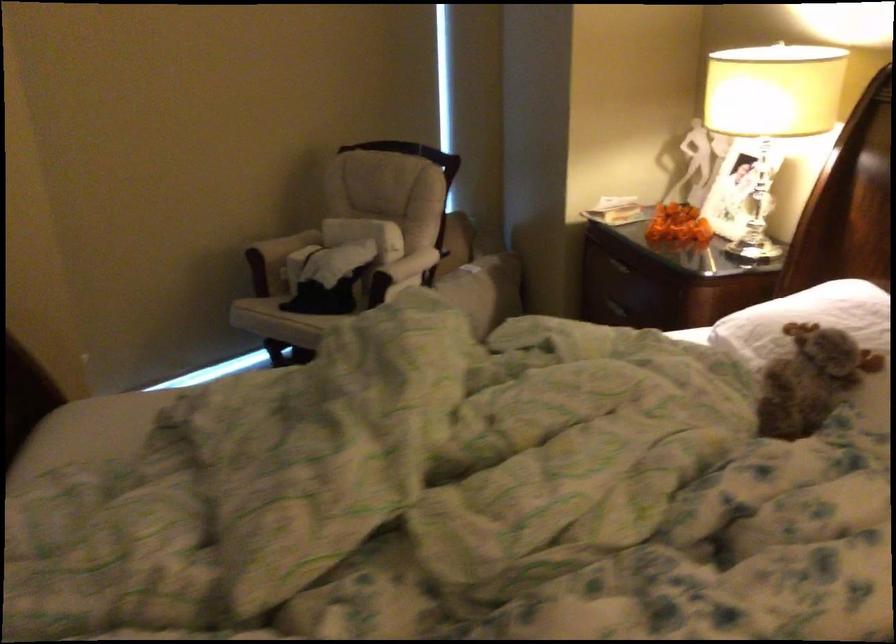
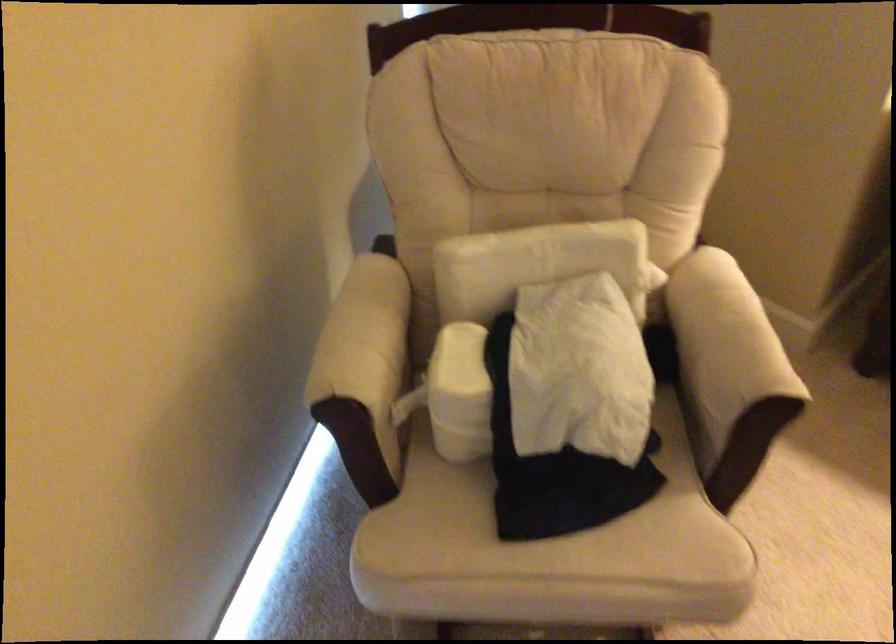
Locate, in the second image, the point that corresponds to pixel 391 261 in the first image.

(724, 348)